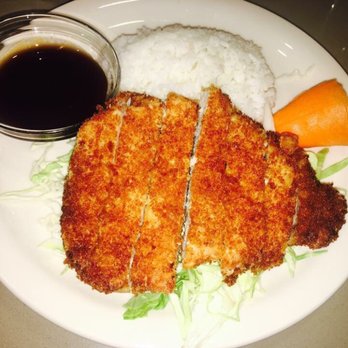
The width and height of the screenshot is (348, 348). Identify the location of gray table. (35, 323).